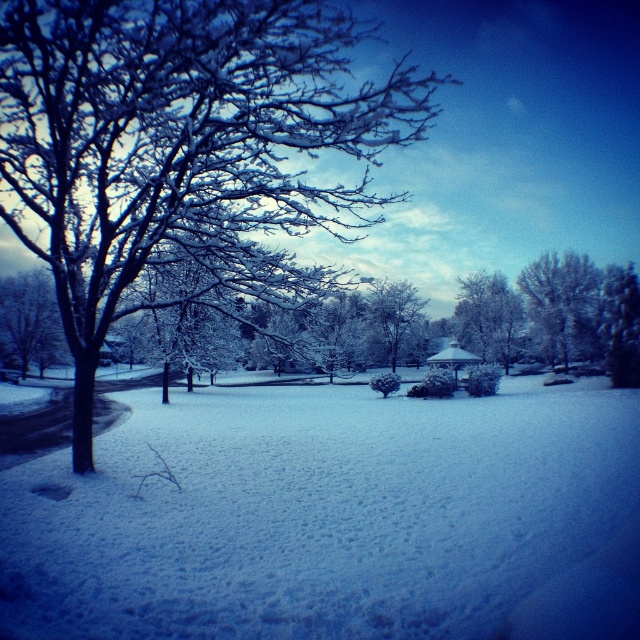
You are standing in the winter scene and want to know how far the point at coordinates (506, 358) is from you. Can you determine the distance?

The point at coordinates (506, 358) is 46.11 meters away from you.

You are an artist planning to paint the winter scene. You want to ensure the white frosty tree at upper right and the snowy bark tree at center are proportionally accurate. Which tree should you paint wider?

The snowy bark tree at center should be painted wider since its width is greater than the white frosty tree at upper right.

Based on the scene, where is the white frosty tree at center located in terms of coordinates?

The white frosty tree at center is located at point coordinates of (486, 316).